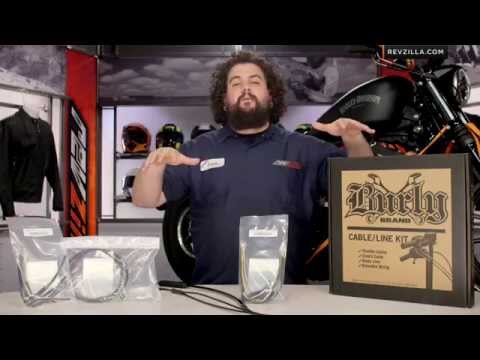
You are a GUI agent. You are given a task and a screenshot of the screen. Output one action in this format:
    pyautogui.click(x=<x>, y=<y>)
    Task: Click on the box
    The image size is (480, 360).
    Given the screenshot: What is the action you would take?
    pyautogui.click(x=397, y=267)